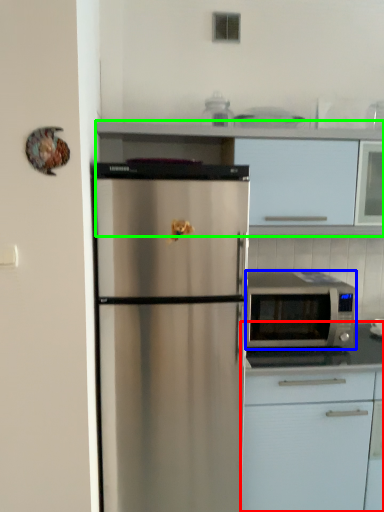
Question: Estimate the real-world distances between objects in this image. Which object is closer to cabinetry (highlighted by a red box), microwave oven (highlighted by a blue box) or cabinetry (highlighted by a green box)?

Choices:
 (A) microwave oven
 (B) cabinetry

Answer: (A)